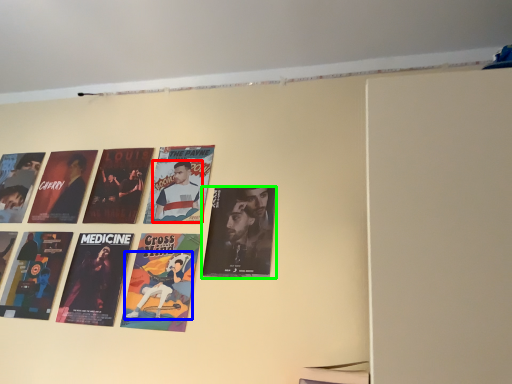
Question: Estimate the real-world distances between objects in this image. Which object is farther from person (highlighted by a red box), person (highlighted by a blue box) or poster (highlighted by a green box)?

Choices:
 (A) person
 (B) poster

Answer: (A)